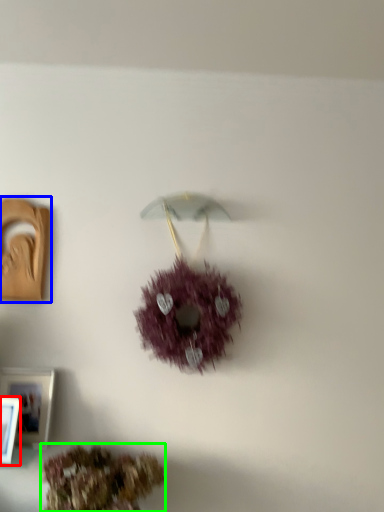
Question: Estimate the real-world distances between objects in this image. Which object is farther from picture frame (highlighted by a red box), picture frame (highlighted by a blue box) or flower (highlighted by a green box)?

Choices:
 (A) picture frame
 (B) flower

Answer: (A)